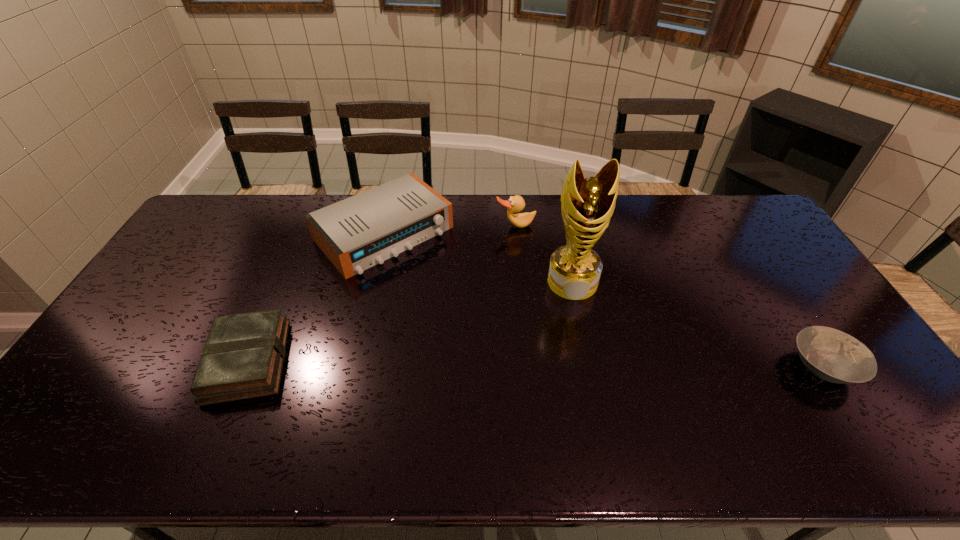
Where is `free space located 0.390m on the control panel of the radio receiver`? free space located 0.390m on the control panel of the radio receiver is located at coordinates (501, 345).

You are a GUI agent. You are given a task and a screenshot of the screen. Output one action in this format:
    pyautogui.click(x=<x>, y=<y>)
    Task: Click on the vacant region located on the control panel of the radio receiver
    The image size is (960, 540).
    Given the screenshot: What is the action you would take?
    pyautogui.click(x=492, y=336)

At what (x,y) coordinates should I click in order to perform the action: click on vacant space located 0.170m on the front-facing side of the tallest object. Please return your answer as a coordinate pair (x, y). The image size is (960, 540). Looking at the image, I should click on (581, 347).

At what (x,y) coordinates should I click in order to perform the action: click on free region located on the front-facing side of the tallest object. Please return your answer as a coordinate pair (x, y). The width and height of the screenshot is (960, 540). Looking at the image, I should click on point(582,356).

This screenshot has width=960, height=540. I want to click on blank area located on the front-facing side of the tallest object, so click(580, 341).

In order to click on vacant area situated on the beak of the duck in this screenshot , I will do `click(540, 282)`.

This screenshot has height=540, width=960. In order to click on vacant space located on the beak of the duck in this screenshot , I will do `click(541, 285)`.

Where is `vacant space positioned on the beak of the duck`? This screenshot has width=960, height=540. vacant space positioned on the beak of the duck is located at coordinates (547, 299).

Identify the location of radio receiver at the far edge. (364, 230).

At what (x,y) coordinates should I click in order to perform the action: click on duck at the far edge. Please return your answer as a coordinate pair (x, y). This screenshot has width=960, height=540. Looking at the image, I should click on (516, 203).